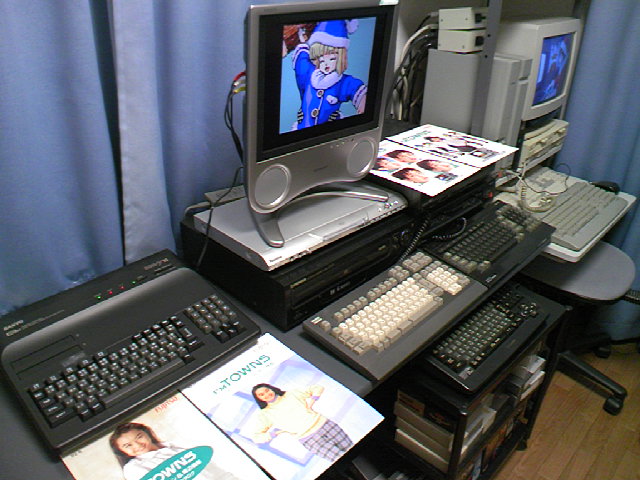
Where is `cord`? The height and width of the screenshot is (480, 640). cord is located at coordinates (410, 97), (411, 57), (428, 36), (431, 19), (232, 97), (228, 136).